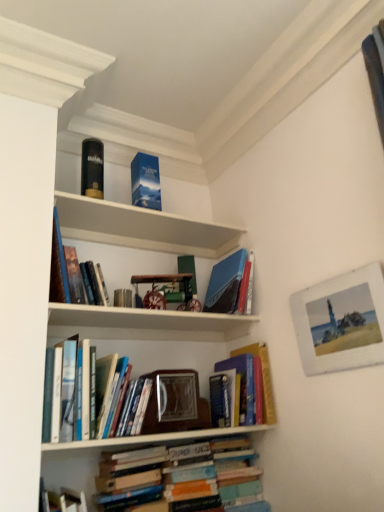
Question: From their relative heights in the image, would you say matte black book at upper left, which is counted as the first paperback book, starting from the left, is taller or shorter than blue cardboard box at upper center?

Choices:
 (A) tall
 (B) short

Answer: (A)

Question: From a real-world perspective, is matte black book at upper left, which is counted as the first paperback book, starting from the left, above or below blue cardboard box at upper center?

Choices:
 (A) below
 (B) above

Answer: (B)

Question: Which object is positioned closest to the hardcover books at lower center, which is counted as the fourth book, starting from the top?

Choices:
 (A) blue matte book at upper center, marked as the second paperback book in a left-to-right arrangement
 (B) hardcover books at center, the third book from the bottom
 (C) white wooden picture frame at upper right
 (D) hardcover book at upper left, which is the 4th book in bottom-to-top order
 (E) matte black book at upper left, which is counted as the first paperback book, starting from the left

Answer: (B)

Question: Estimate the real-world distances between objects in this image. Which object is closer to the matte black book at upper left, which is counted as the first paperback book, starting from the left?

Choices:
 (A) hardcover book at upper left, positioned as the first book in top-to-bottom order
 (B) hardcover books at lower center, positioned as the first book in bottom-to-top order
 (C) hardcover book at center, which is the second book in bottom-to-top order
 (D) blue cardboard box at upper center
 (E) white wooden picture frame at upper right

Answer: (D)